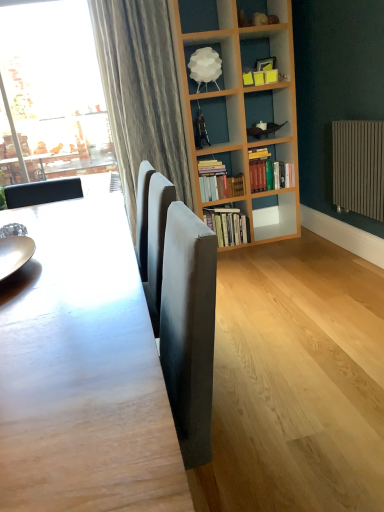
Question: Which direction should I rotate to face hardcover books at center, the 2th book in the bottom-to-top sequence, — up or down?

Choices:
 (A) up
 (B) down

Answer: (A)

Question: Considering the relative sizes of white matte lampshade at upper center and hardcover books at center, the 3th book when ordered from top to bottom, in the image provided, is white matte lampshade at upper center thinner than hardcover books at center, the 3th book when ordered from top to bottom,?

Choices:
 (A) no
 (B) yes

Answer: (B)

Question: Is white matte lampshade at upper center to the right of hardcover books at center, the 3th book when ordered from top to bottom, from the viewer's perspective?

Choices:
 (A) no
 (B) yes

Answer: (A)

Question: Is white matte lampshade at upper center located outside hardcover books at center, the 3th book when ordered from top to bottom?

Choices:
 (A) yes
 (B) no

Answer: (A)

Question: Does white matte lampshade at upper center have a greater height compared to hardcover books at center, the 3th book when ordered from top to bottom?

Choices:
 (A) no
 (B) yes

Answer: (A)

Question: From the image's perspective, does white matte lampshade at upper center appear lower than hardcover books at center, the 3th book when ordered from top to bottom?

Choices:
 (A) yes
 (B) no

Answer: (B)

Question: Is hardcover books at center, the 3th book when ordered from top to bottom, at the back of white matte lampshade at upper center?

Choices:
 (A) no
 (B) yes

Answer: (A)

Question: Does shiny metallic plate at left appear on the left side of white matte lampshade at upper center?

Choices:
 (A) yes
 (B) no

Answer: (A)

Question: Is shiny metallic plate at left surrounding white matte lampshade at upper center?

Choices:
 (A) no
 (B) yes

Answer: (A)

Question: From a real-world perspective, does shiny metallic plate at left stand above white matte lampshade at upper center?

Choices:
 (A) no
 (B) yes

Answer: (A)

Question: Considering the relative sizes of shiny metallic plate at left and white matte lampshade at upper center in the image provided, is shiny metallic plate at left shorter than white matte lampshade at upper center?

Choices:
 (A) no
 (B) yes

Answer: (B)

Question: Is shiny metallic plate at left further to the viewer compared to white matte lampshade at upper center?

Choices:
 (A) no
 (B) yes

Answer: (A)

Question: Is shiny metallic plate at left oriented towards white matte lampshade at upper center?

Choices:
 (A) no
 (B) yes

Answer: (A)

Question: From a real-world perspective, does shiny metallic plate at left sit lower than hardcover books at center, which ranks as the 1th book in top-to-bottom order?

Choices:
 (A) yes
 (B) no

Answer: (B)